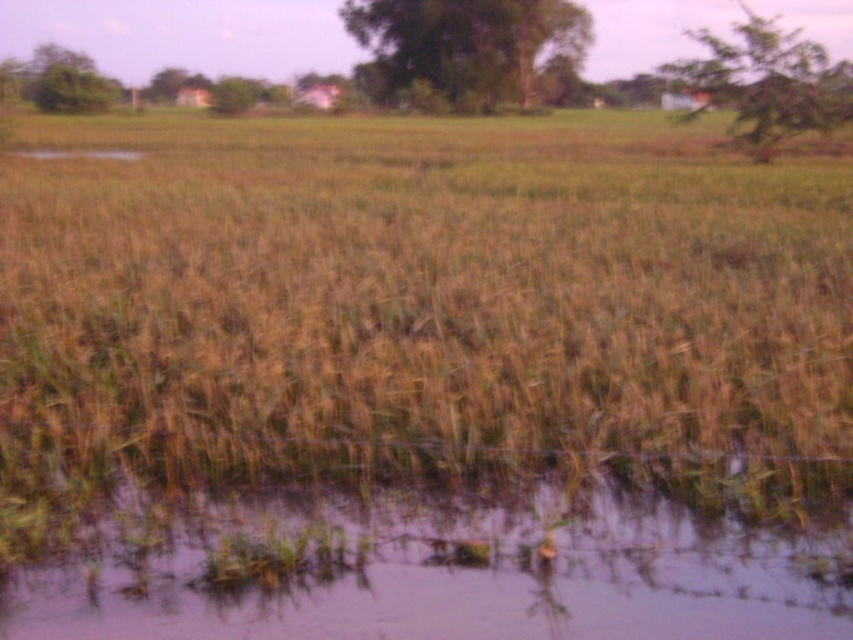
Is brown grass at center shorter than translucent muddy water at lower center?

No.

The image size is (853, 640). What do you see at coordinates (416, 296) in the screenshot?
I see `brown grass at center` at bounding box center [416, 296].

This screenshot has width=853, height=640. Describe the element at coordinates (416, 296) in the screenshot. I see `brown grass at center` at that location.

Identify the location of brown grass at center. coord(416,296).